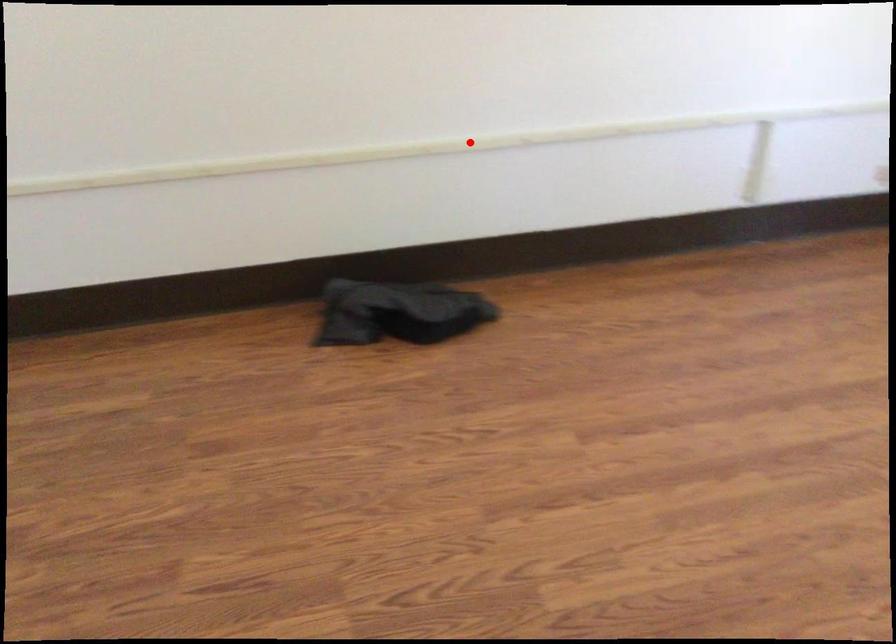
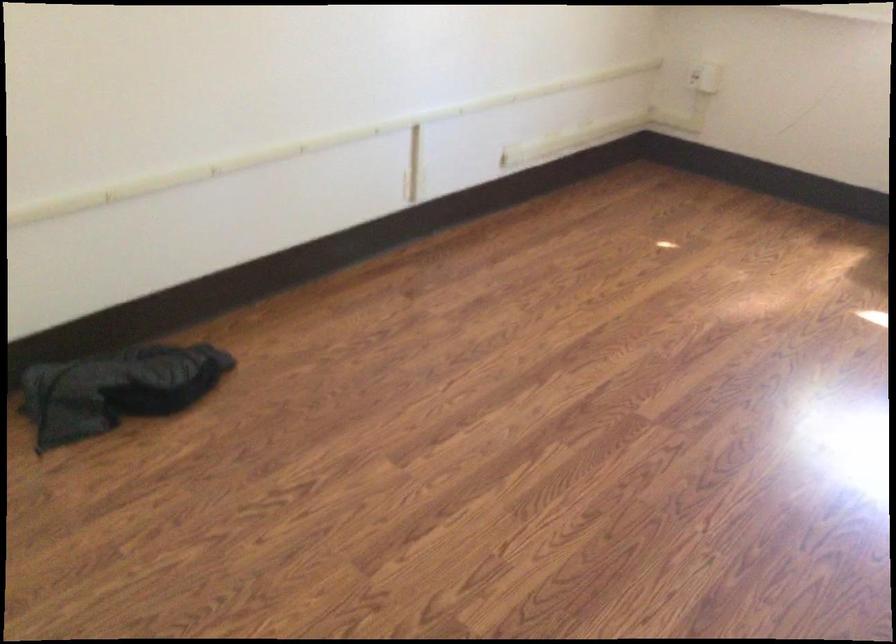
Question: I am providing you with two images of the same scene from different viewpoints. Image1 has a red point marked. In image2, the corresponding 3D location appears at what relative position? Reply with the corresponding letter.

Choices:
 (A) Closer
 (B) Farther

Answer: (A)